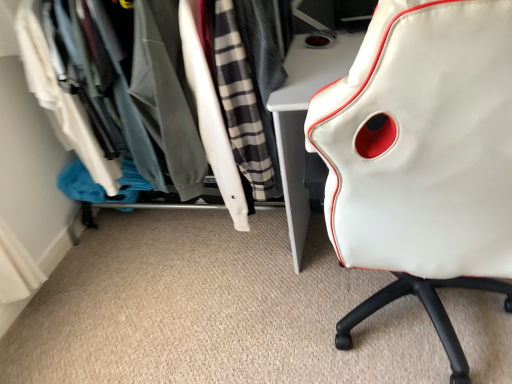
This screenshot has width=512, height=384. What do you see at coordinates (59, 97) in the screenshot?
I see `white fabric closet at upper left` at bounding box center [59, 97].

Based on the photo, measure the distance between white fabric closet at upper left and camera.

white fabric closet at upper left and camera are 1.38 meters apart from each other.

At what (x,y) coordinates should I click in order to perform the action: click on white fabric closet at upper left. Please return your answer as a coordinate pair (x, y). The image size is (512, 384). Looking at the image, I should click on (59, 97).

What is the approximate width of white leather chair at right?

It is 72.05 centimeters.

Describe the element at coordinates (422, 157) in the screenshot. I see `white leather chair at right` at that location.

This screenshot has width=512, height=384. I want to click on white leather chair at right, so click(x=422, y=157).

This screenshot has height=384, width=512. In order to click on white fabric closet at upper left in this screenshot , I will do `click(59, 97)`.

Considering the relative positions of white fabric closet at upper left and white leather chair at right in the image provided, is white fabric closet at upper left to the left or to the right of white leather chair at right?

From the image, it's evident that white fabric closet at upper left is to the left of white leather chair at right.

Does white fabric closet at upper left lie behind white leather chair at right?

Yes, white fabric closet at upper left is further from the viewer.

Is point (87, 137) farther from camera compared to point (331, 88)?

Yes.

From the image's perspective, who appears lower, white fabric closet at upper left or white leather chair at right?

white leather chair at right.

From a real-world perspective, is white fabric closet at upper left positioned above or below white leather chair at right?

white fabric closet at upper left is below white leather chair at right.

Based on the photo, can you confirm if white fabric closet at upper left is wider than white leather chair at right?

No, white fabric closet at upper left is not wider than white leather chair at right.

Considering the sizes of objects white fabric closet at upper left and white leather chair at right in the image provided, who is taller, white fabric closet at upper left or white leather chair at right?

Standing taller between the two is white leather chair at right.

Can you confirm if white fabric closet at upper left is bigger than white leather chair at right?

Indeed, white fabric closet at upper left has a larger size compared to white leather chair at right.

Does white fabric closet at upper left contain white leather chair at right?

No, white leather chair at right is not inside white fabric closet at upper left.

Is there a large distance between white fabric closet at upper left and white leather chair at right?

Result: Absolutely, white fabric closet at upper left is distant from white leather chair at right.

Is white leather chair at right at the back of white fabric closet at upper left?

No, white leather chair at right is not at the back of white fabric closet at upper left.

Image resolution: width=512 pixels, height=384 pixels. What are the coordinates of `chair that is above the white fabric closet at upper left (from a real-world perspective)` in the screenshot? It's located at (422, 157).

Is white leather chair at right to the left or to the right of white fabric closet at upper left in the image?

white leather chair at right is positioned on white fabric closet at upper left's right side.

Does white leather chair at right come behind white fabric closet at upper left?

No, white leather chair at right is closer to the viewer.

Is point (388, 200) closer or farther from the camera than point (232, 176)?

Clearly, point (388, 200) is closer to the camera than point (232, 176).

From the picture: From the image's perspective, relative to white fabric closet at upper left, is white leather chair at right above or below?

From the image's perspective, white leather chair at right appears below white fabric closet at upper left.

From a real-world perspective, does white leather chair at right stand above white fabric closet at upper left?

Yes, from a real-world perspective, white leather chair at right is above white fabric closet at upper left.

In terms of width, does white leather chair at right look wider or thinner when compared to white fabric closet at upper left?

Considering their sizes, white leather chair at right looks broader than white fabric closet at upper left.

In terms of height, does white leather chair at right look taller or shorter compared to white fabric closet at upper left?

Clearly, white leather chair at right is taller compared to white fabric closet at upper left.

Can you confirm if white leather chair at right is smaller than white fabric closet at upper left?

Correct, white leather chair at right occupies less space than white fabric closet at upper left.

Is white leather chair at right positioned beyond the bounds of white fabric closet at upper left?

Yes, white leather chair at right is not within white fabric closet at upper left.

In the scene shown: Is white leather chair at right with white fabric closet at upper left?

No, white leather chair at right is not with white fabric closet at upper left.

Looking at this image, does white leather chair at right turn towards white fabric closet at upper left?

No, white leather chair at right is not aimed at white fabric closet at upper left.

Measure the distance between white leather chair at right and white fabric closet at upper left.

A distance of 1.19 meters exists between white leather chair at right and white fabric closet at upper left.

At what (x,y) coordinates should I click in order to perform the action: click on chair in front of the white fabric closet at upper left. Please return your answer as a coordinate pair (x, y). This screenshot has width=512, height=384. Looking at the image, I should click on tap(422, 157).

The image size is (512, 384). What are the coordinates of `closet located above the white leather chair at right (from the image's perspective)` in the screenshot? It's located at (59, 97).

Locate an element on the screen. chair above the white fabric closet at upper left (from a real-world perspective) is located at coordinates 422,157.